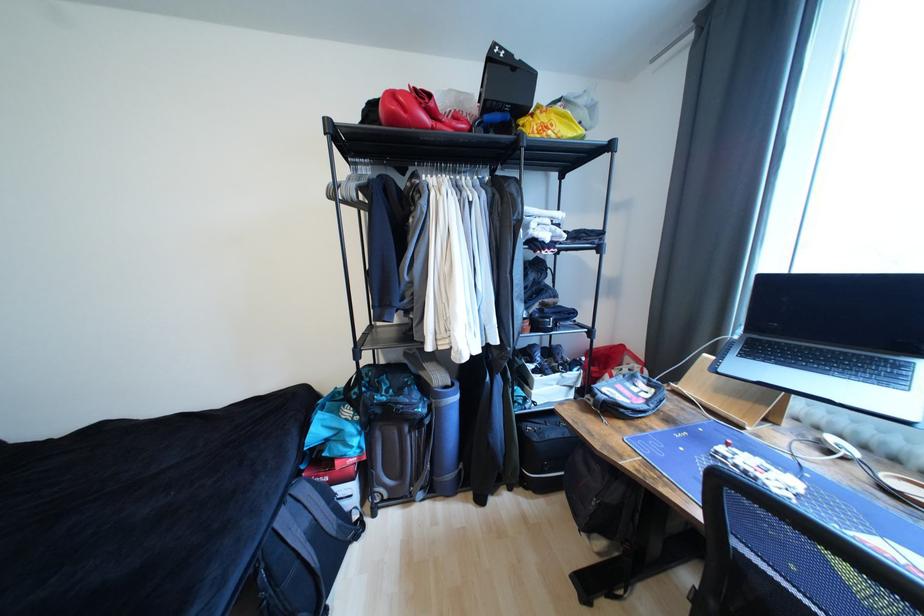
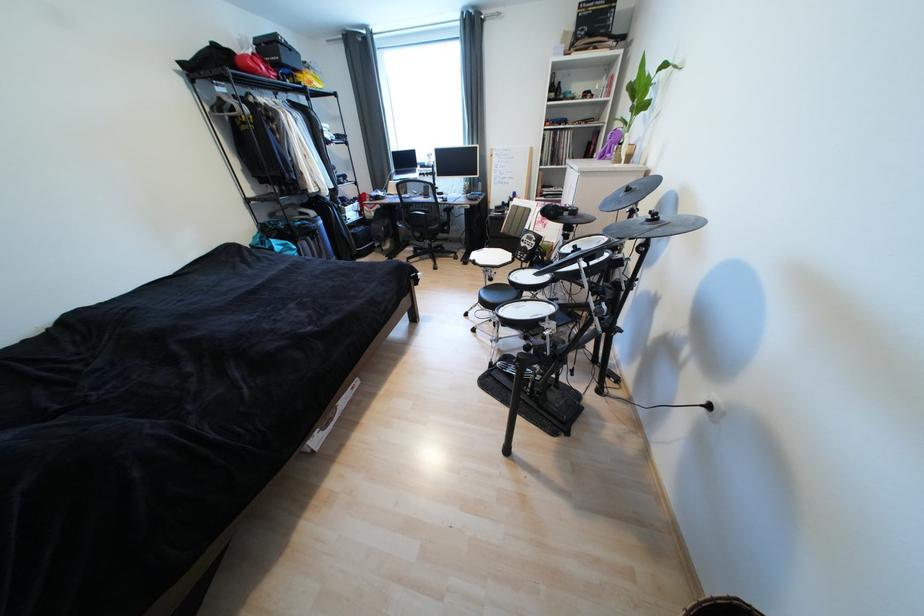
Find the pixel in the second image that matches pixel 400 121 in the first image.

(261, 73)